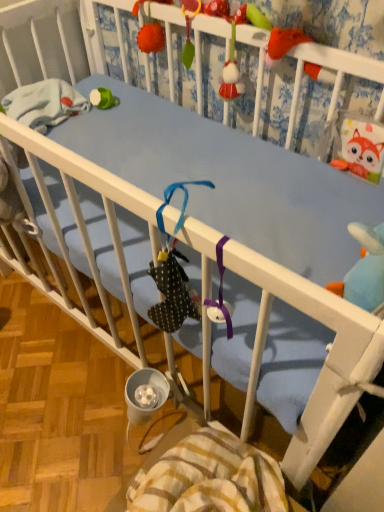
Question: From their relative heights in the image, would you say blue fabric crib at upper center is taller or shorter than striped cotton blanket at lower center?

Choices:
 (A) short
 (B) tall

Answer: (B)

Question: Considering the positions of point (211, 8) and point (203, 481), is point (211, 8) closer or farther from the camera than point (203, 481)?

Choices:
 (A) farther
 (B) closer

Answer: (A)

Question: Which object is positioned farthest from the striped cotton blanket at lower center?

Choices:
 (A) blue fabric crib at upper center
 (B) fluffy orange pom-pom at upper center

Answer: (B)

Question: Considering the real-world distances, which object is farthest from the blue fabric crib at upper center?

Choices:
 (A) striped cotton blanket at lower center
 (B) fluffy orange pom-pom at upper center

Answer: (A)